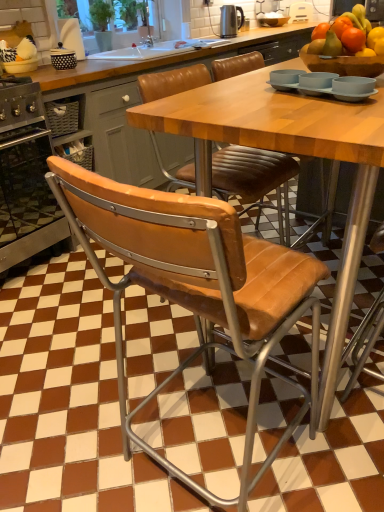
Question: Would you say white plastic toaster at upper center, which is counted as the 1th appliance, starting from the back, contains leather-like tan chair at center?

Choices:
 (A) no
 (B) yes

Answer: (A)

Question: Is white plastic toaster at upper center, the 2th appliance from the left, aimed at leather-like tan chair at center?

Choices:
 (A) yes
 (B) no

Answer: (A)

Question: Is white plastic toaster at upper center, the 2th appliance in the bottom-to-top sequence, located outside leather-like tan chair at center?

Choices:
 (A) no
 (B) yes

Answer: (B)

Question: Is white plastic toaster at upper center, marked as the first appliance in a right-to-left arrangement, behind leather-like tan chair at center?

Choices:
 (A) no
 (B) yes

Answer: (B)

Question: Can you confirm if white plastic toaster at upper center, the second appliance in the front-to-back sequence, is shorter than leather-like tan chair at center?

Choices:
 (A) yes
 (B) no

Answer: (B)

Question: From the image's perspective, would you say white plastic toaster at upper center, the 1th appliance when ordered from top to bottom, is shown under leather-like tan chair at center?

Choices:
 (A) yes
 (B) no

Answer: (B)

Question: Considering the relative sizes of leather-like tan chair at center and polished stainless steel kettle at upper center, which is the second appliance from top to bottom, in the image provided, is leather-like tan chair at center thinner than polished stainless steel kettle at upper center, which is the second appliance from top to bottom,?

Choices:
 (A) no
 (B) yes

Answer: (A)

Question: Considering the relative positions of leather-like tan chair at center and polished stainless steel kettle at upper center, marked as the 1th appliance in a front-to-back arrangement, in the image provided, is leather-like tan chair at center in front of polished stainless steel kettle at upper center, marked as the 1th appliance in a front-to-back arrangement,?

Choices:
 (A) yes
 (B) no

Answer: (A)

Question: Is the position of leather-like tan chair at center more distant than that of polished stainless steel kettle at upper center, which is the second appliance from top to bottom?

Choices:
 (A) no
 (B) yes

Answer: (A)

Question: Is leather-like tan chair at center at the right side of polished stainless steel kettle at upper center, positioned as the first appliance in bottom-to-top order?

Choices:
 (A) no
 (B) yes

Answer: (A)

Question: From a real-world perspective, is leather-like tan chair at center below polished stainless steel kettle at upper center, the second appliance positioned from the back?

Choices:
 (A) yes
 (B) no

Answer: (A)

Question: Considering the relative sizes of leather-like tan chair at center and polished stainless steel kettle at upper center, the first appliance positioned from the left, in the image provided, is leather-like tan chair at center shorter than polished stainless steel kettle at upper center, the first appliance positioned from the left,?

Choices:
 (A) yes
 (B) no

Answer: (A)

Question: Is stainless steel oven at left not close to leather-like tan chair at center?

Choices:
 (A) yes
 (B) no

Answer: (A)